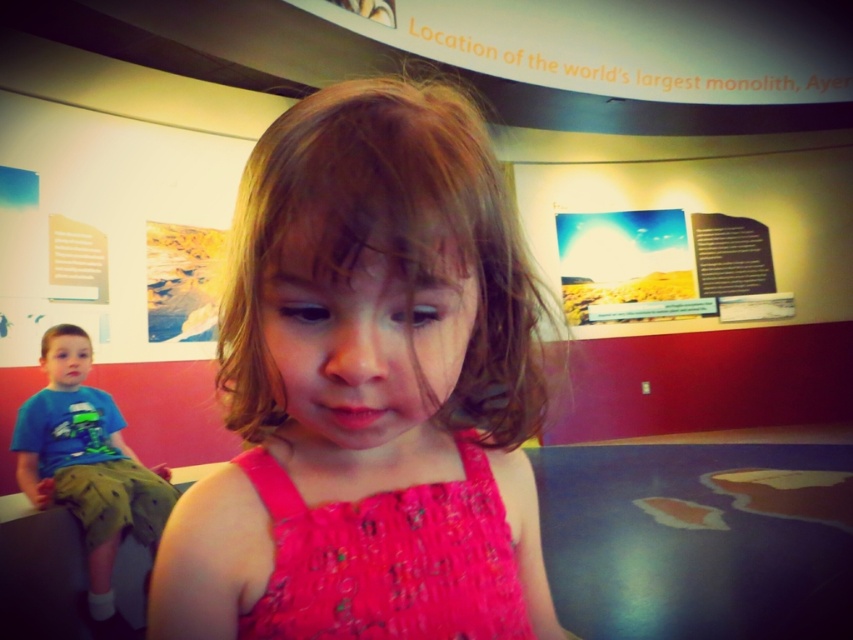
Question: Estimate the real-world distances between objects in this image. Which object is closer to the pink fabric at center?

Choices:
 (A) pink fabric dress at center
 (B) blue-green t-shirt at left
 (C) brown matte hair at left
 (D) smooth skin face at left

Answer: (A)

Question: Among these points, which one is farthest from the camera?

Choices:
 (A) (73, 500)
 (B) (265, 624)

Answer: (A)

Question: Is pink fabric dress at center thinner than blue-green t-shirt at left?

Choices:
 (A) no
 (B) yes

Answer: (B)

Question: Which point is closer to the camera?

Choices:
 (A) blue-green t-shirt at left
 (B) pink lace dress at center

Answer: (B)

Question: Is pink lace dress at center to the right of brown matte hair at left from the viewer's perspective?

Choices:
 (A) no
 (B) yes

Answer: (B)

Question: Can you confirm if pink fabric at center is positioned to the left of blue-green t-shirt at left?

Choices:
 (A) no
 (B) yes

Answer: (A)